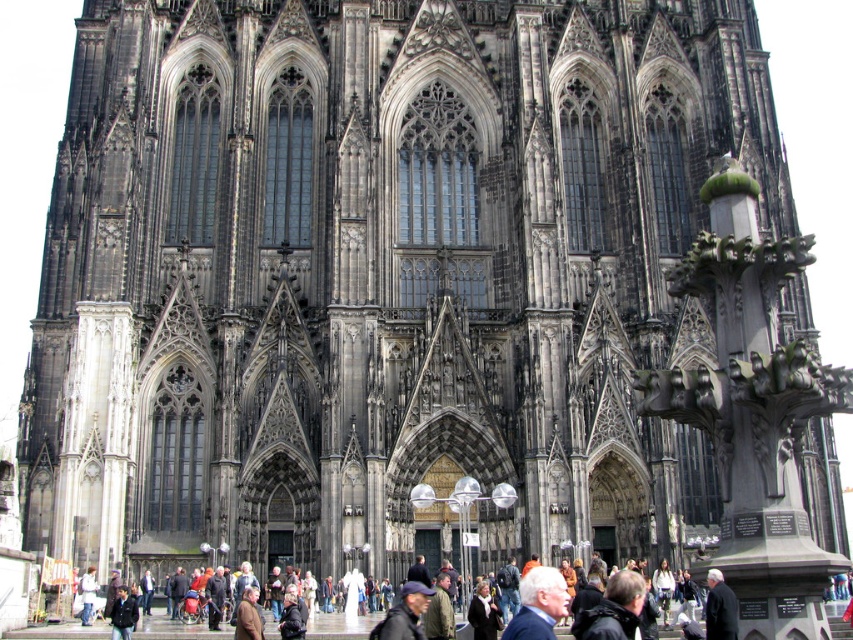
You are standing in front of the Cologne Cathedral and want to hand your blue fabric jacket at lower center to a friend who is holding the dark brown leather jacket at lower left. Can you reach them directly without moving from your spot?

The distance between the blue fabric jacket at lower center and the dark brown leather jacket at lower left is 24.96 meters, so you cannot reach them directly without moving from your current position.